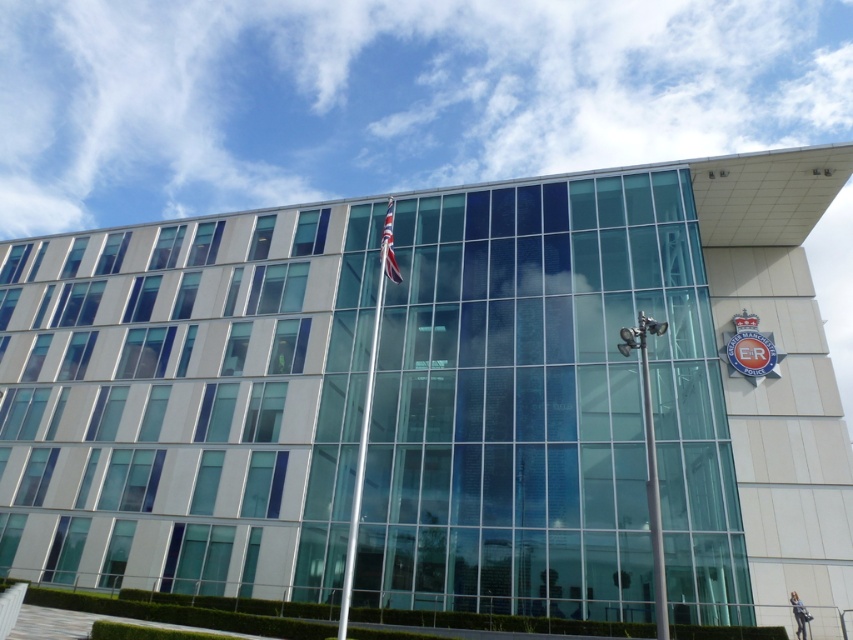
Question: Among these points, which one is nearest to the camera?

Choices:
 (A) (386, 230)
 (B) (392, 220)

Answer: (A)

Question: Considering the relative positions of silver metallic flag pole at center and red flag at upper center in the image provided, where is silver metallic flag pole at center located with respect to red flag at upper center?

Choices:
 (A) left
 (B) right

Answer: (A)

Question: Can you confirm if silver metallic flag pole at center is wider than red flag at upper center?

Choices:
 (A) yes
 (B) no

Answer: (A)

Question: Does silver metallic flag pole at center appear on the right side of red flag at upper center?

Choices:
 (A) yes
 (B) no

Answer: (B)